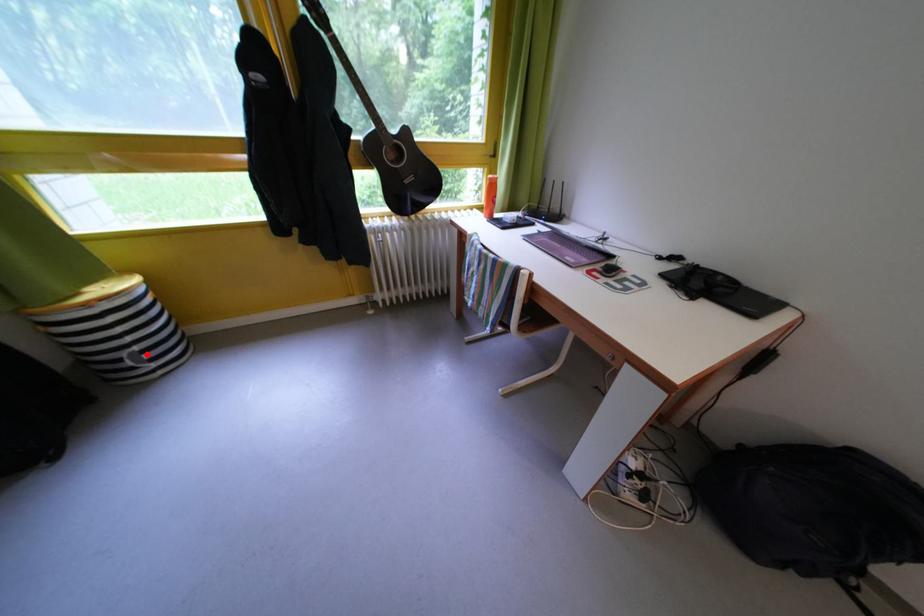
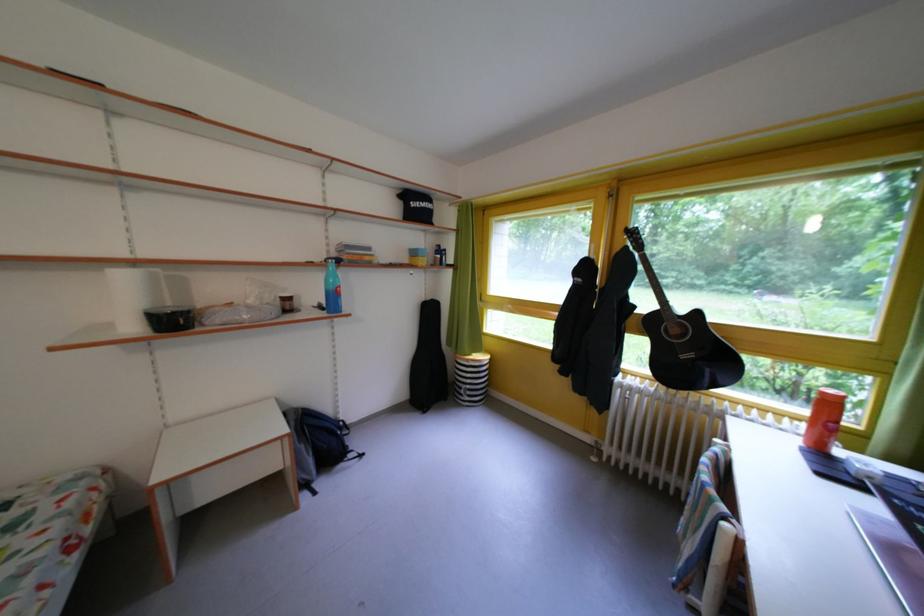
Question: I am providing you with two images of the same scene from different viewpoints. In image1, a red point is highlighted. Considering the same 3D point in image2, which of the following is correct?

Choices:
 (A) It is closer
 (B) It is farther

Answer: (B)